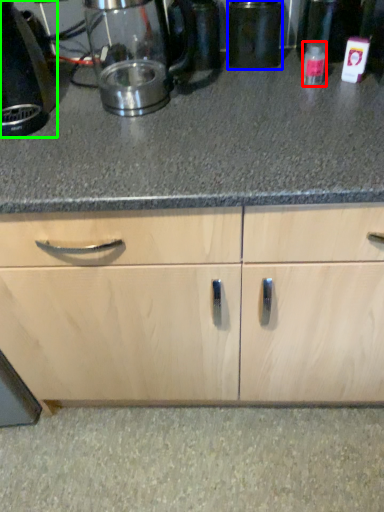
Question: Which object is the closest to the bottle (highlighted by a red box)? Choose among these: appliance (highlighted by a blue box) or home appliance (highlighted by a green box).

Choices:
 (A) appliance
 (B) home appliance

Answer: (A)